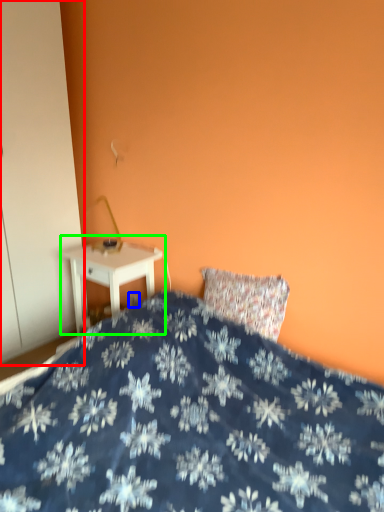
Question: Which is nearer to the armoire (highlighted by a red box)? electric outlet (highlighted by a blue box) or nightstand (highlighted by a green box).

Choices:
 (A) electric outlet
 (B) nightstand

Answer: (B)